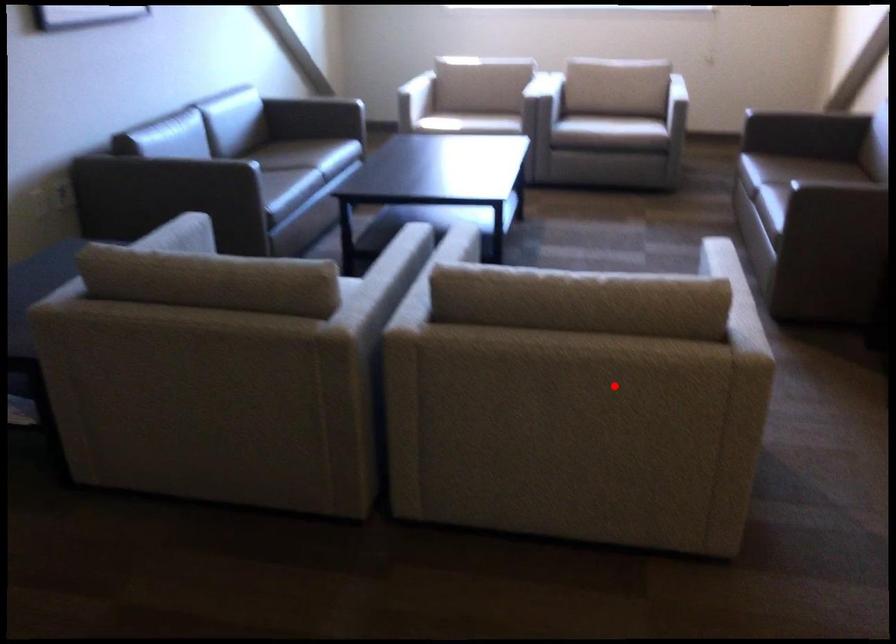
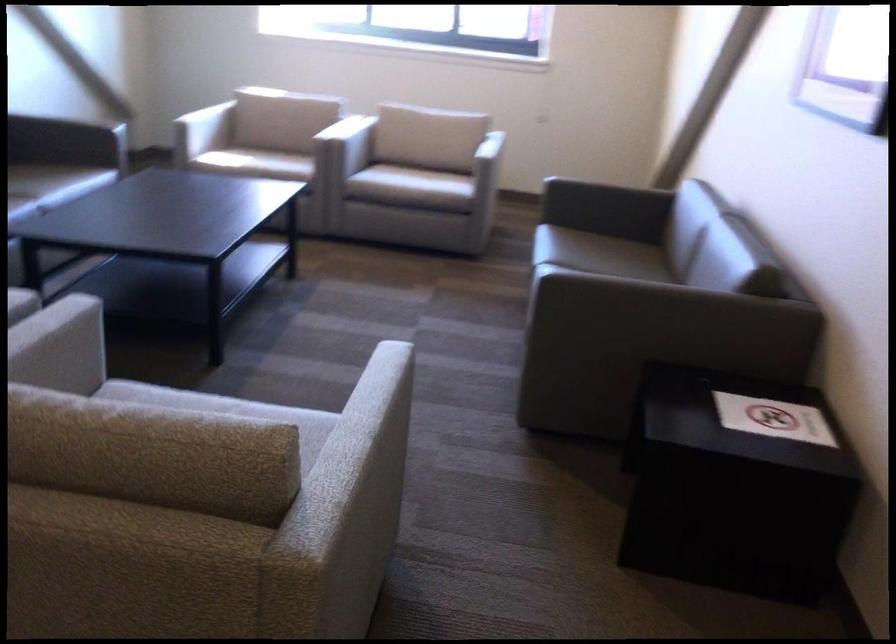
Find the pixel in the second image that matches the highlighted location in the first image.

(115, 596)